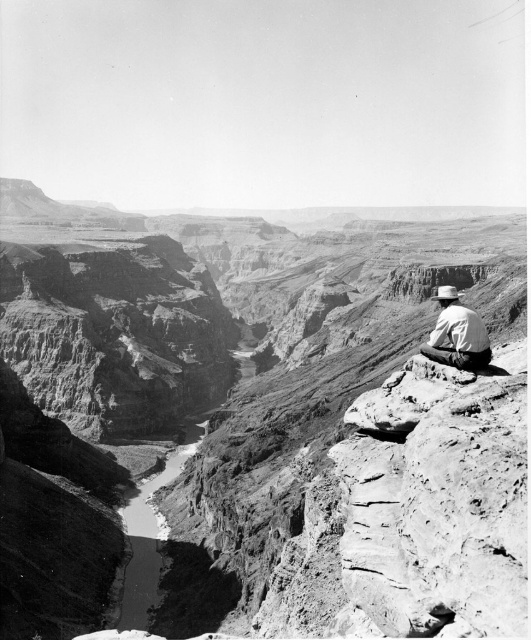
Is point (438, 342) closer to camera compared to point (435, 291)?

Yes.

Between light brown leather hat at center and white felt cowboy hat at right, which one has more height?

With more height is light brown leather hat at center.

Is point (456, 291) farther from camera compared to point (452, 294)?

Yes, point (456, 291) is behind point (452, 294).

Image resolution: width=531 pixels, height=640 pixels. In order to click on light brown leather hat at center in this screenshot , I will do `click(457, 333)`.

Which is behind, point (190, 282) or point (444, 298)?

The point (190, 282) is more distant.

Does rugged rock canyon at center have a smaller size compared to light brown leather hat at center?

No, rugged rock canyon at center is not smaller than light brown leather hat at center.

This screenshot has height=640, width=531. In order to click on rugged rock canyon at center in this screenshot , I will do `click(233, 333)`.

Identify the location of rugged rock canyon at center. (233, 333).

Is rugged rock canyon at center bigger than white felt cowboy hat at right?

Indeed, rugged rock canyon at center has a larger size compared to white felt cowboy hat at right.

Is point (500, 262) less distant than point (438, 289)?

Yes, point (500, 262) is closer to viewer.

This screenshot has height=640, width=531. What are the coordinates of `rugged rock canyon at center` in the screenshot? It's located at (233, 333).